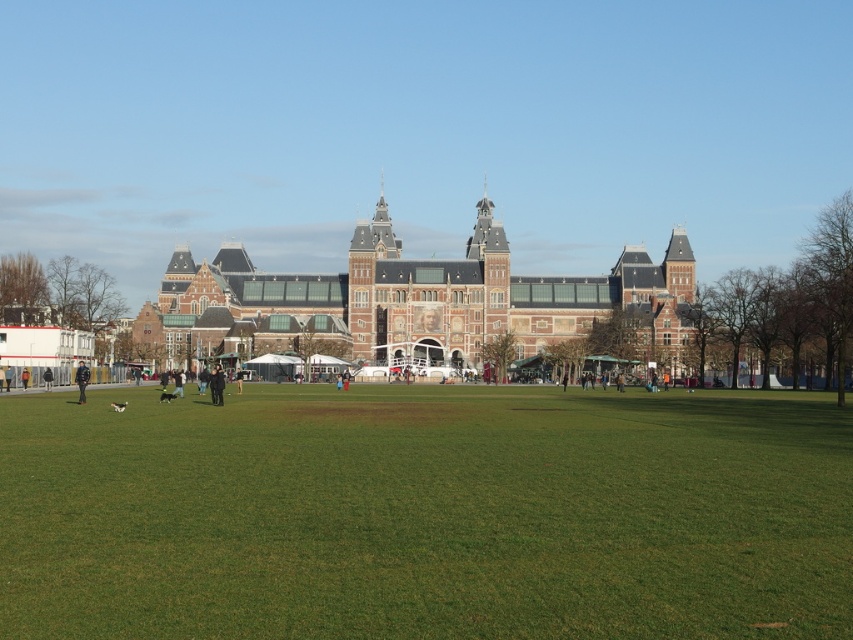
You are standing in front of the historic building and want to walk to the dark brown leather jacket at center. Is there enough space to walk directly to it without stepping on the green grass at center?

The green grass at center might be wider than dark brown leather jacket at center, so there could be enough space to walk directly to the jacket without stepping on the grass. However, since the grass is at the center, you might need to walk through it to reach the jacket.

You are a fashion designer observing two jackets in a plaza scene. You need to decide which jacket to recommend for a client who prefers a slimmer fit. Which one should you choose between the dark brown leather jacket at center and the black leather jacket at lower left?

The dark brown leather jacket at center is thinner than the black leather jacket at lower left, so you should recommend the dark brown leather jacket at center for a slimmer fit.